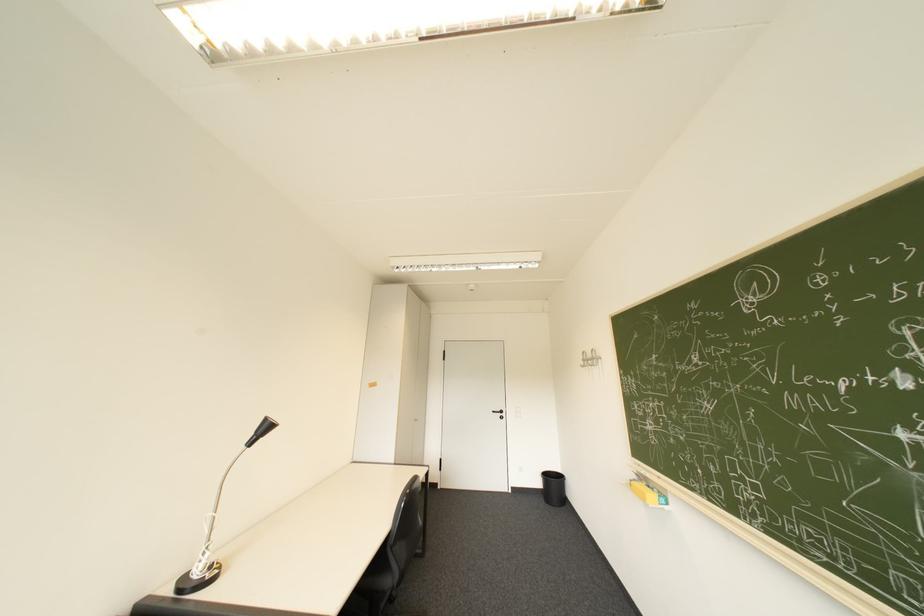
What do you see at coordinates (590, 358) in the screenshot? I see `a metal wall hook` at bounding box center [590, 358].